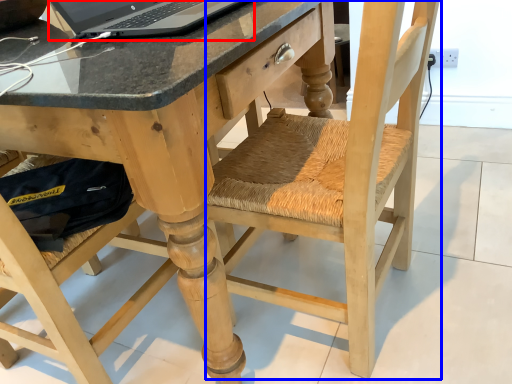
Question: Which point is further to the camera, laptop (highlighted by a red box) or swivel chair (highlighted by a blue box)?

Choices:
 (A) laptop
 (B) swivel chair

Answer: (A)